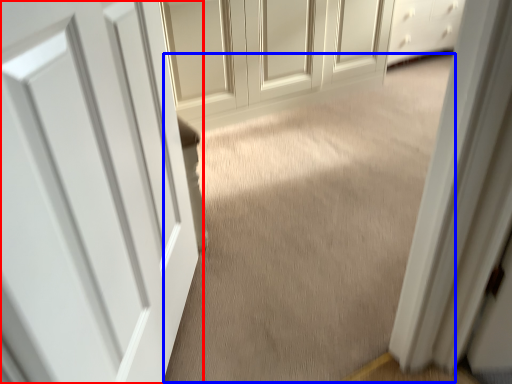
Question: Among these objects, which one is nearest to the camera, door (highlighted by a red box) or plain (highlighted by a blue box)?

Choices:
 (A) door
 (B) plain

Answer: (A)